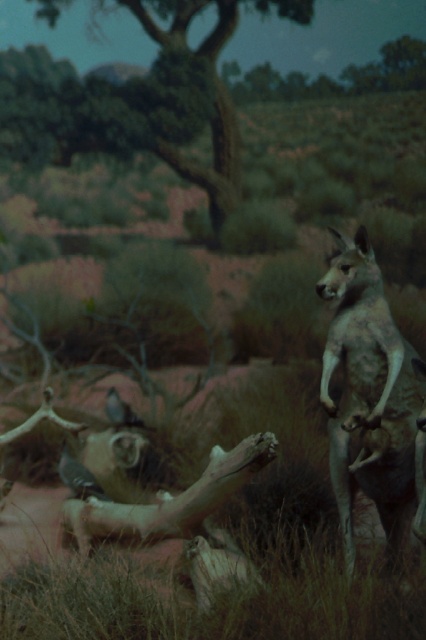
Who is more forward, (x=43, y=138) or (x=336, y=243)?

Positioned in front is point (x=336, y=243).

Is green leafy tree at upper center thinner than smooth gray kangaroo at right?

Incorrect, green leafy tree at upper center's width is not less than smooth gray kangaroo at right's.

Does point (219, 125) lie in front of point (397, 401)?

That is False.

The height and width of the screenshot is (640, 426). In order to click on green leafy tree at upper center in this screenshot , I will do `click(157, 100)`.

This screenshot has height=640, width=426. In order to click on matte gray bird at lower left in this screenshot , I will do `click(78, 476)`.

At what (x,y) coordinates should I click in order to perform the action: click on matte gray bird at lower left. Please return your answer as a coordinate pair (x, y). Image resolution: width=426 pixels, height=640 pixels. Looking at the image, I should click on (78, 476).

How much distance is there between smooth gray kangaroo at right and matte gray bird at lower left?

A distance of 5.00 feet exists between smooth gray kangaroo at right and matte gray bird at lower left.

Does point (374, 352) lie in front of point (63, 476)?

Yes, point (374, 352) is in front of point (63, 476).

At what (x,y) coordinates should I click in order to perform the action: click on smooth gray kangaroo at right. Please return your answer as a coordinate pair (x, y). This screenshot has width=426, height=640. Looking at the image, I should click on (368, 394).